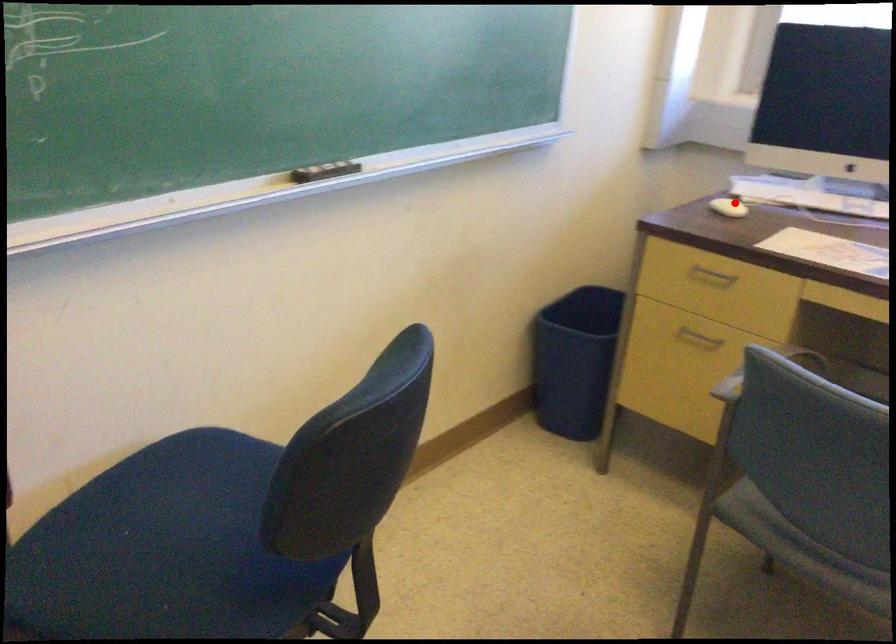
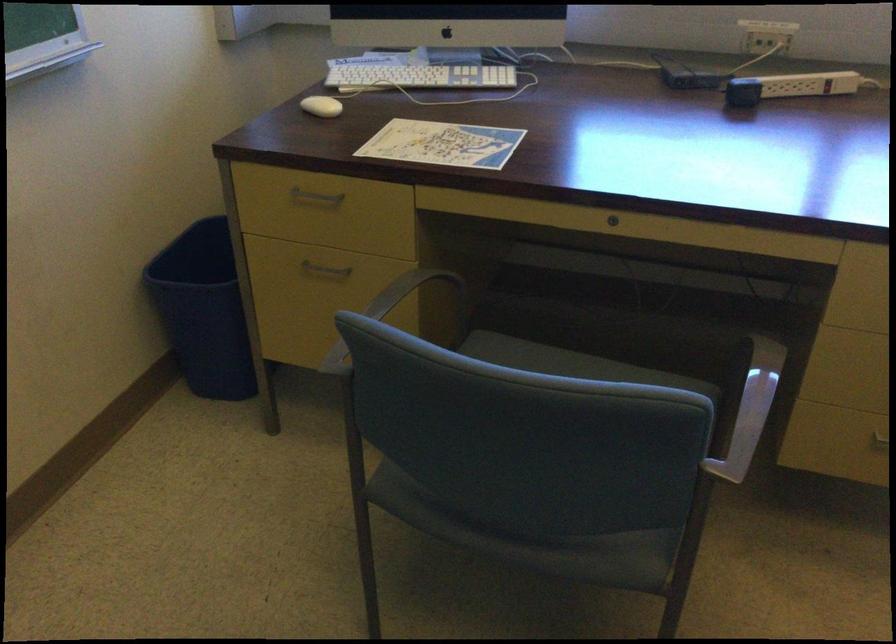
Question: I am providing you with two images of the same scene from different viewpoints. In image1, a red point is highlighted. Considering the same 3D point in image2, which of the following is correct?

Choices:
 (A) It is closer
 (B) It is farther

Answer: (A)